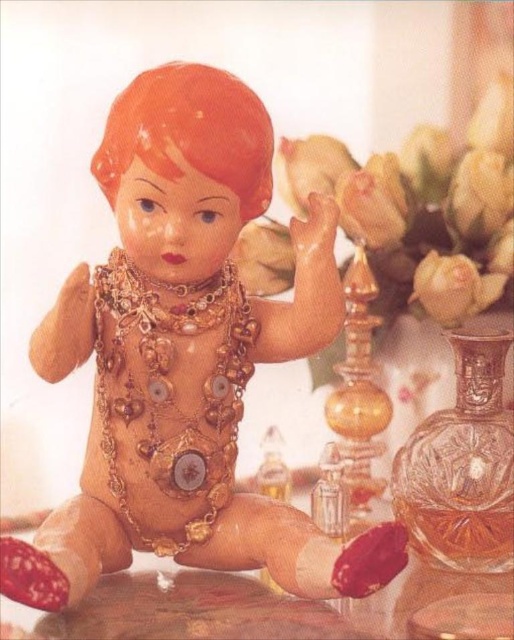
Question: Observing the image, what is the correct spatial positioning of matte gold doll at center in reference to smooth wooden table at center?

Choices:
 (A) above
 (B) below

Answer: (A)

Question: Does matte gold doll at center have a smaller size compared to smooth wooden table at center?

Choices:
 (A) yes
 (B) no

Answer: (B)

Question: Which of the following is the farthest from the observer?

Choices:
 (A) matte gold doll at center
 (B) smooth wooden table at center

Answer: (B)

Question: Does matte gold doll at center appear on the right side of smooth wooden table at center?

Choices:
 (A) no
 (B) yes

Answer: (A)

Question: Among these objects, which one is nearest to the camera?

Choices:
 (A) matte gold doll at center
 (B) smooth wooden table at center

Answer: (A)